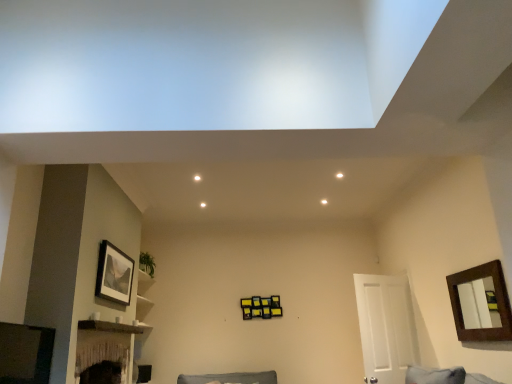
Question: Does brown wooden picture frame at upper right, which is the first picture frame in right-to-left order, have a greater width compared to matte black picture frame at upper left, the 1th picture frame positioned from the left?

Choices:
 (A) no
 (B) yes

Answer: (A)

Question: From the image's perspective, is brown wooden picture frame at upper right, the 2th picture frame from the left, located above matte black picture frame at upper left, the 2th picture frame when ordered from right to left?

Choices:
 (A) yes
 (B) no

Answer: (B)

Question: Is brown wooden picture frame at upper right, the 2th picture frame from the left, not close to matte black picture frame at upper left, the 1th picture frame positioned from the left?

Choices:
 (A) no
 (B) yes

Answer: (B)

Question: From a real-world perspective, is brown wooden picture frame at upper right, which is the first picture frame in right-to-left order, on matte black picture frame at upper left, the 1th picture frame positioned from the left?

Choices:
 (A) no
 (B) yes

Answer: (A)

Question: From the image's perspective, is brown wooden picture frame at upper right, which is the first picture frame in right-to-left order, under matte black picture frame at upper left, the 1th picture frame positioned from the left?

Choices:
 (A) yes
 (B) no

Answer: (A)

Question: Is the position of brown wooden picture frame at upper right, the 2th picture frame from the left, more distant than that of matte black picture frame at upper left, the 2th picture frame when ordered from right to left?

Choices:
 (A) no
 (B) yes

Answer: (A)

Question: Is there a large distance between brown wooden picture frame at upper right, which is the first picture frame in right-to-left order, and white matte door at right?

Choices:
 (A) yes
 (B) no

Answer: (A)

Question: Considering the relative sizes of brown wooden picture frame at upper right, which is the first picture frame in right-to-left order, and white matte door at right in the image provided, is brown wooden picture frame at upper right, which is the first picture frame in right-to-left order, wider than white matte door at right?

Choices:
 (A) yes
 (B) no

Answer: (B)

Question: Is brown wooden picture frame at upper right, which is the first picture frame in right-to-left order, further to camera compared to white matte door at right?

Choices:
 (A) yes
 (B) no

Answer: (B)

Question: Is brown wooden picture frame at upper right, which is the first picture frame in right-to-left order, aimed at white matte door at right?

Choices:
 (A) no
 (B) yes

Answer: (A)

Question: Is brown wooden picture frame at upper right, which is the first picture frame in right-to-left order, oriented away from white matte door at right?

Choices:
 (A) yes
 (B) no

Answer: (B)

Question: Is white matte door at right a part of brown wooden picture frame at upper right, which is the first picture frame in right-to-left order?

Choices:
 (A) yes
 (B) no

Answer: (B)

Question: Can you confirm if brown wooden shelf at lower left is shorter than white matte door at right?

Choices:
 (A) no
 (B) yes

Answer: (B)